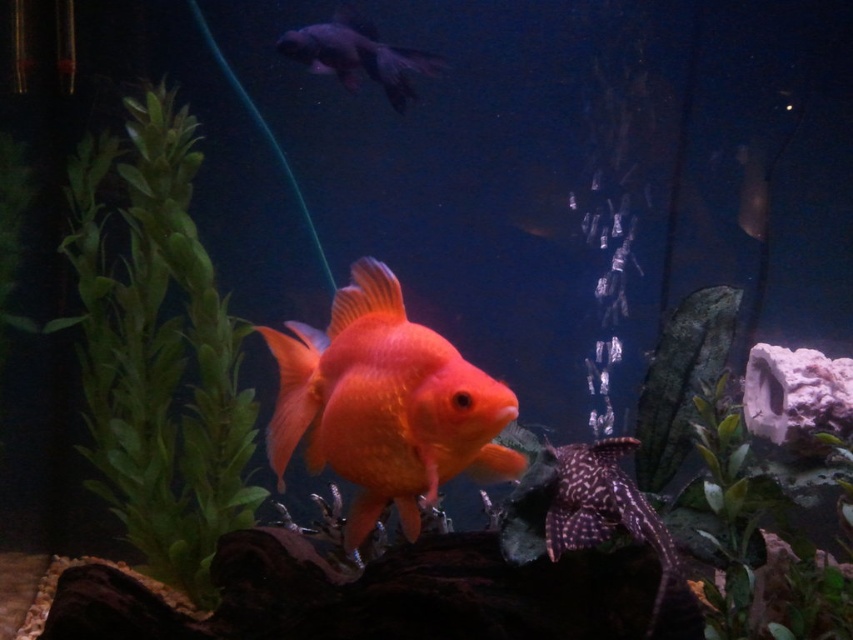
You are a marine biologist observing the aquarium. You notice two fish, the shiny orange fish at center and the shiny black fish at upper center. Which fish has a smaller body width?

The shiny orange fish at center is thinner than the shiny black fish at upper center, so the shiny orange fish at center has a smaller body width.

Looking at this image, you are a new fish in the aquarium and want to swim to the shiny orange fish at center. Which direction should you swim from your current position at point (386,404)?

The shiny orange fish at center is located at point (386,404), so you are already at the same position as the shiny orange fish at center.